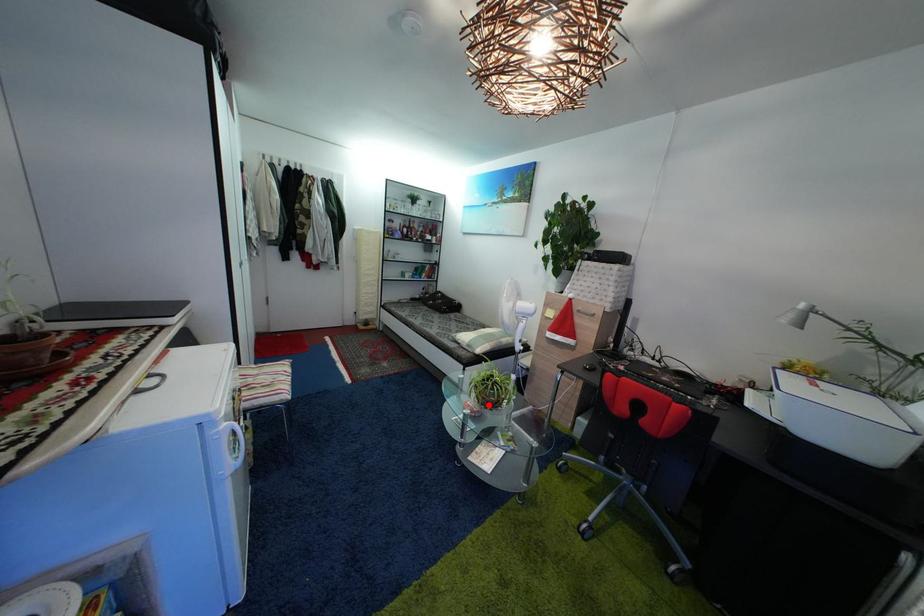
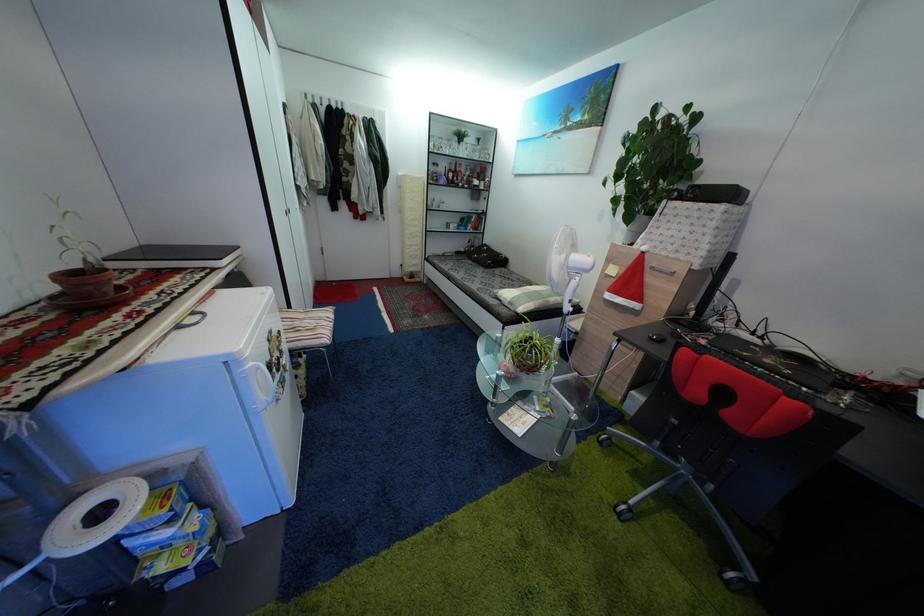
The point at the highlighted location is marked in the first image. Where is the corresponding point in the second image?

(525, 368)